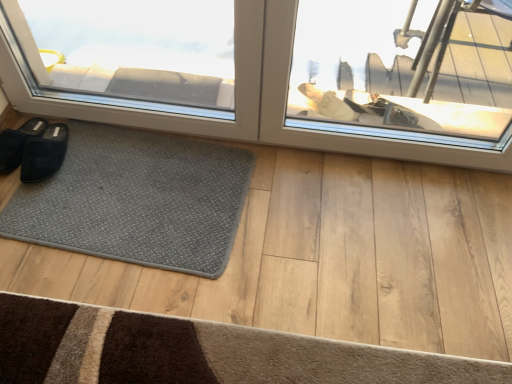
Locate an element on the screen. vacant space to the right of gray textured mat at lower left is located at coordinates (309, 233).